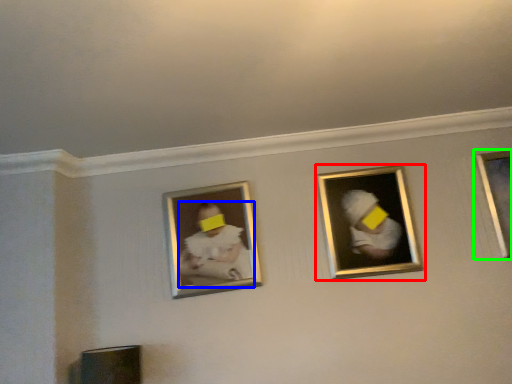
Question: Considering the real-world distances, which object is farthest from picture frame (highlighted by a red box)? person (highlighted by a blue box) or picture frame (highlighted by a green box)?

Choices:
 (A) person
 (B) picture frame

Answer: (A)